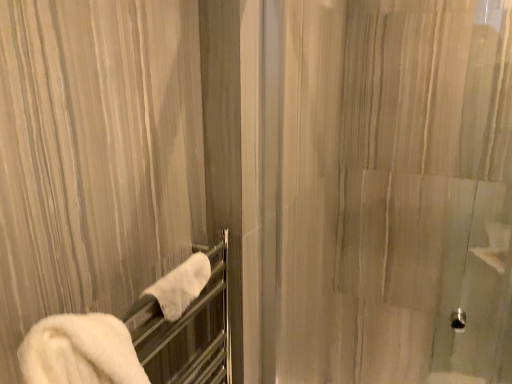
Question: Should I look upward or downward to see translucent glass shower door at center?

Choices:
 (A) up
 (B) down

Answer: (B)